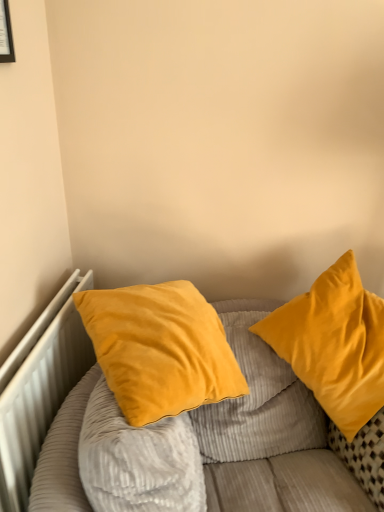
Question: Is velvet yellow pillow at center, which appears as the second pillow when viewed from the right, positioned behind velvet yellow pillows at upper right?

Choices:
 (A) no
 (B) yes

Answer: (B)

Question: Is velvet yellow pillow at center, the 1th pillow in the left-to-right sequence, to the left of velvet yellow pillows at upper right from the viewer's perspective?

Choices:
 (A) no
 (B) yes

Answer: (B)

Question: From a real-world perspective, is velvet yellow pillow at center, which appears as the second pillow when viewed from the right, under velvet yellow pillows at upper right?

Choices:
 (A) yes
 (B) no

Answer: (B)

Question: From a real-world perspective, is velvet yellow pillow at center, the 1th pillow in the left-to-right sequence, positioned over velvet yellow pillows at upper right based on gravity?

Choices:
 (A) yes
 (B) no

Answer: (A)

Question: Is velvet yellow pillow at center, which appears as the second pillow when viewed from the right, far from velvet yellow pillows at upper right?

Choices:
 (A) yes
 (B) no

Answer: (B)

Question: From the image's perspective, is velvet yellow pillow at center, the 1th pillow in the left-to-right sequence, located beneath velvet yellow pillows at upper right?

Choices:
 (A) yes
 (B) no

Answer: (B)

Question: Is velvet yellow pillow at right, the 2th pillow positioned from the left, further to camera compared to matte black picture frame at upper left?

Choices:
 (A) no
 (B) yes

Answer: (B)

Question: Does velvet yellow pillow at right, which appears as the first pillow when viewed from the right, contain matte black picture frame at upper left?

Choices:
 (A) no
 (B) yes

Answer: (A)

Question: From a real-world perspective, is velvet yellow pillow at right, the 2th pillow positioned from the left, below matte black picture frame at upper left?

Choices:
 (A) no
 (B) yes

Answer: (B)

Question: Considering the relative sizes of velvet yellow pillow at right, the 2th pillow positioned from the left, and matte black picture frame at upper left in the image provided, is velvet yellow pillow at right, the 2th pillow positioned from the left, taller than matte black picture frame at upper left?

Choices:
 (A) no
 (B) yes

Answer: (B)

Question: From a real-world perspective, is velvet yellow pillow at right, the 2th pillow positioned from the left, over matte black picture frame at upper left?

Choices:
 (A) yes
 (B) no

Answer: (B)

Question: Considering the relative sizes of velvet yellow pillow at right, the 2th pillow positioned from the left, and matte black picture frame at upper left in the image provided, is velvet yellow pillow at right, the 2th pillow positioned from the left, wider than matte black picture frame at upper left?

Choices:
 (A) yes
 (B) no

Answer: (A)

Question: Is matte black picture frame at upper left in front of velvet yellow pillow at right, which appears as the first pillow when viewed from the right?

Choices:
 (A) no
 (B) yes

Answer: (B)